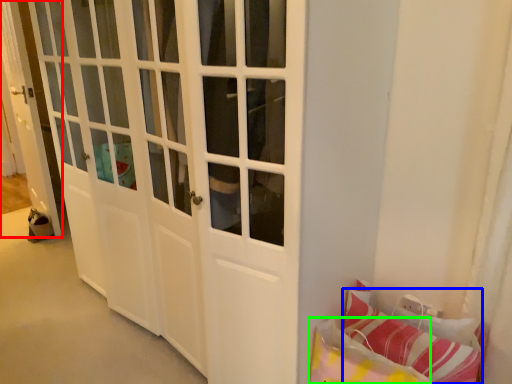
Question: Considering the real-world distances, which object is farthest from door (highlighted by a red box)? pillow (highlighted by a blue box) or pillow (highlighted by a green box)?

Choices:
 (A) pillow
 (B) pillow

Answer: (A)